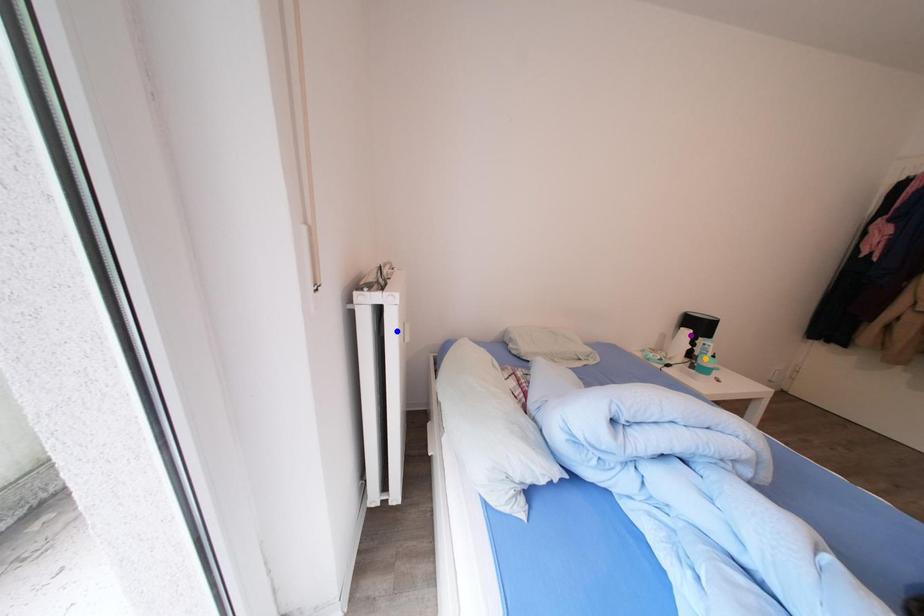
Order these from nearest to farthest:
purple point, orange point, blue point

purple point → orange point → blue point